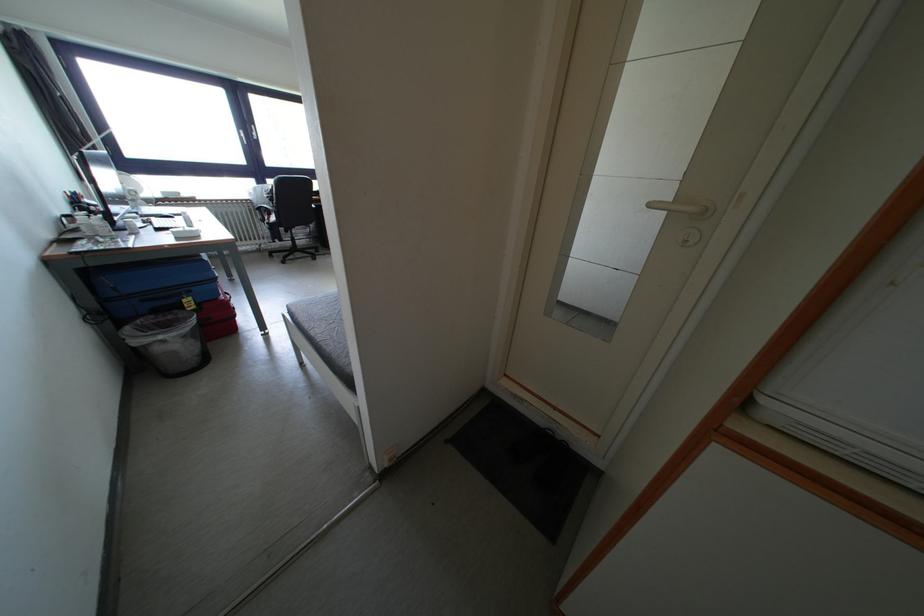
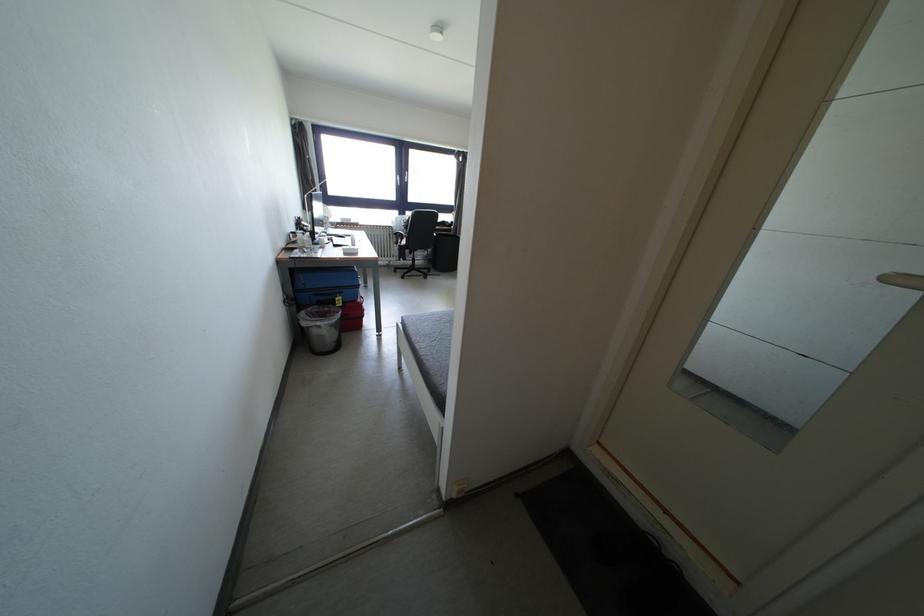
Where in the second image is the point corresponding to (660,209) from the first image?

(898, 284)